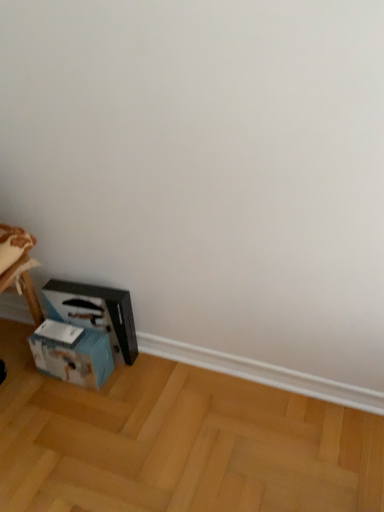
Locate an element on the screen. vacant space to the right of blue cardboard box at lower left is located at coordinates (131, 381).